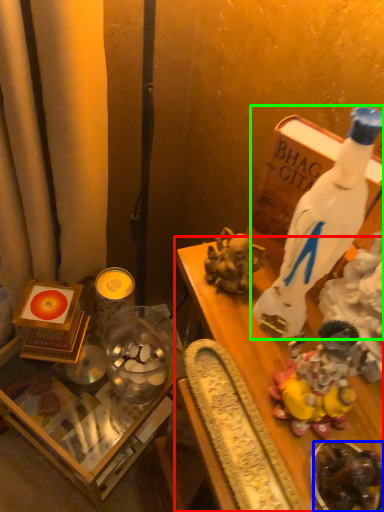
Question: Considering the real-world distances, which object is farthest from furniture (highlighted by a red box)? food (highlighted by a blue box) or bottle (highlighted by a green box)?

Choices:
 (A) food
 (B) bottle

Answer: (B)